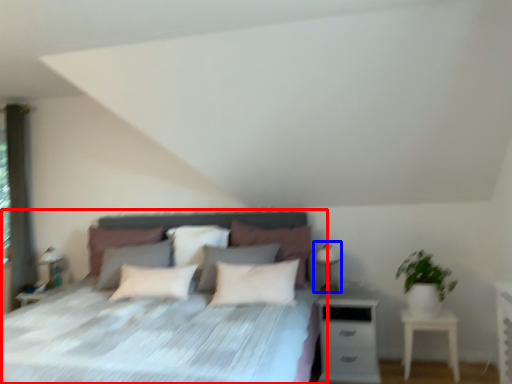
Question: Which of the following is the farthest to the observer, bed (highlighted by a red box) or table lamp (highlighted by a blue box)?

Choices:
 (A) bed
 (B) table lamp

Answer: (B)